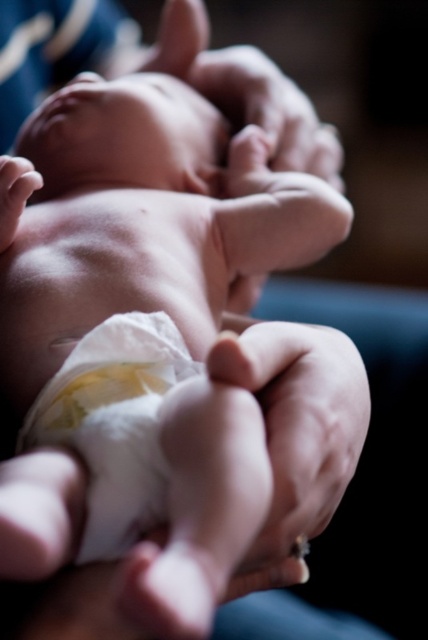
You are a photographer trying to capture the baby in the scene. Which hand, the smooth skin hand at center or the smooth skin hand at lower left, is closer to the camera?

The smooth skin hand at center is closer to the camera because the smooth skin hand at lower left is behind it.